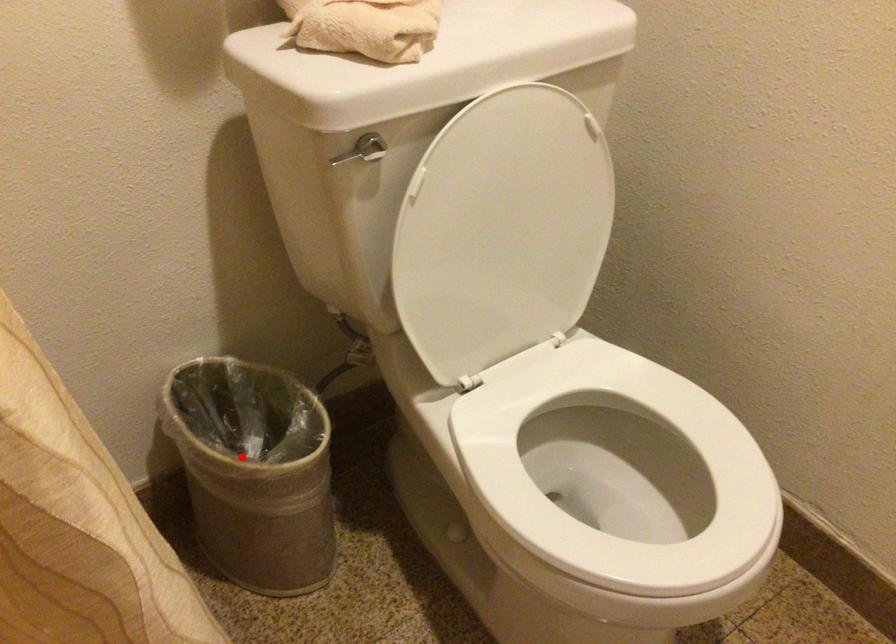
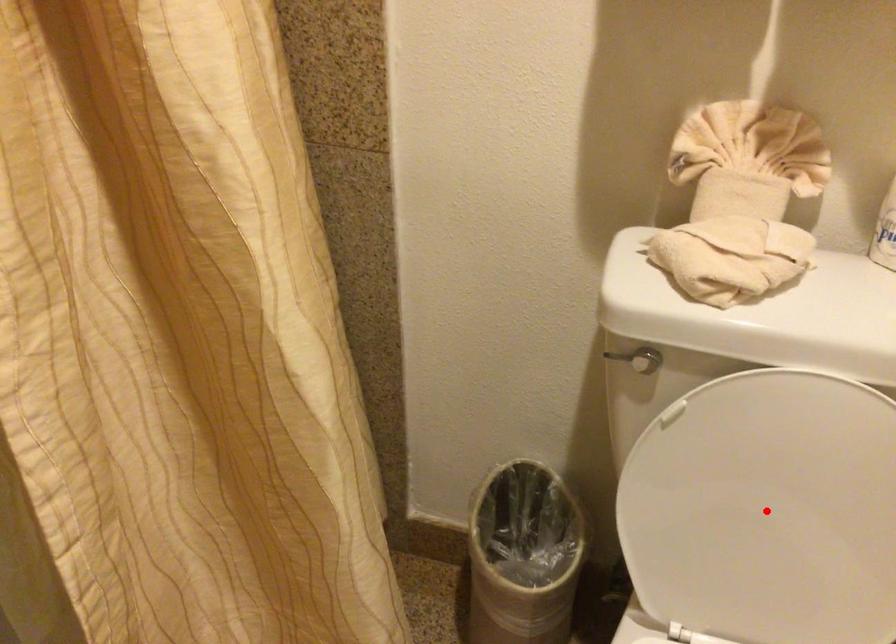
I am providing you with two images of the same scene from different viewpoints. A red point is marked on the first image and another point is marked on the second image. Do the highlighted points in image1 and image2 indicate the same real-world spot?

No